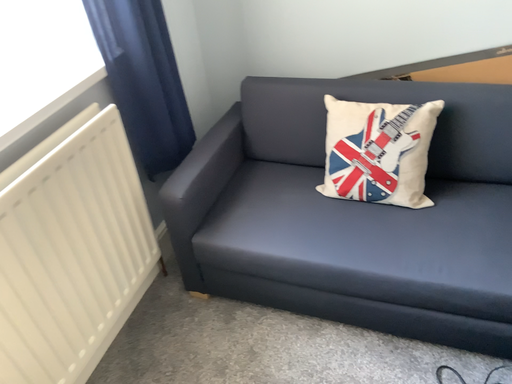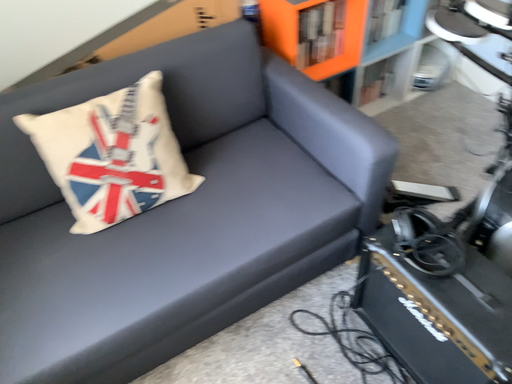
Question: Which way did the camera rotate in the video?

Choices:
 (A) rotated right
 (B) rotated left

Answer: (A)